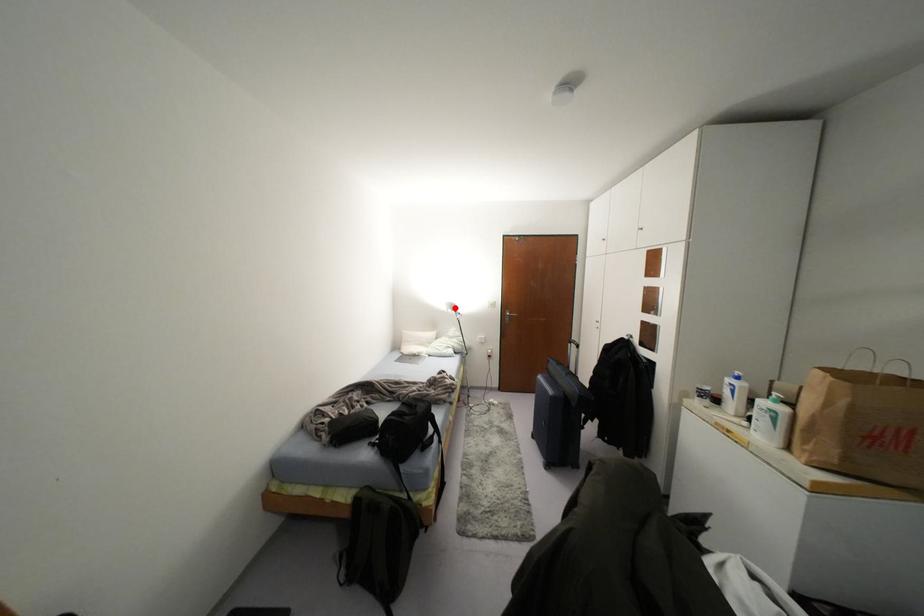
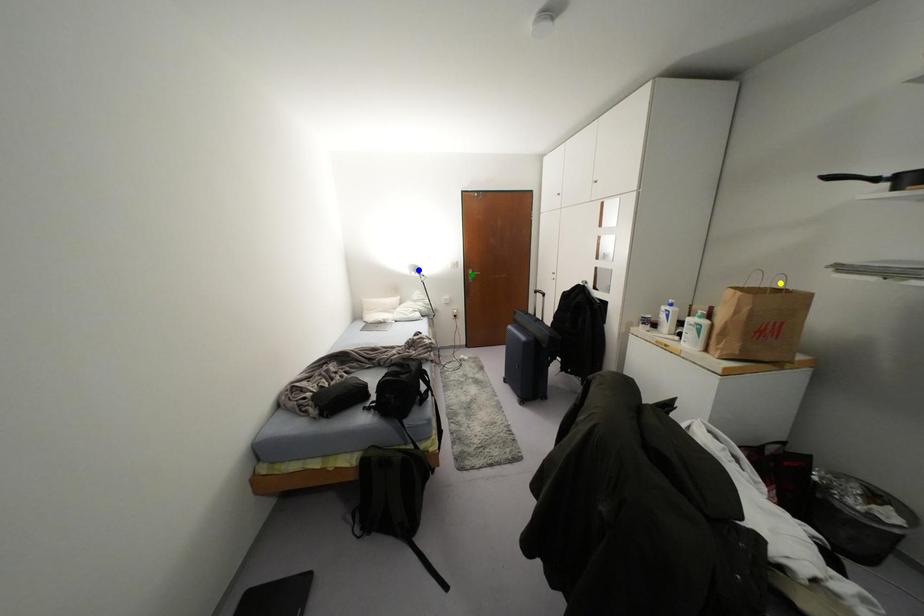
Question: I am providing you with two images of the same scene from different viewpoints. A red point is marked on the first image. You are given multiple points on the second image. In image 2, which mark is for the same physical point as the one in image 1?

Choices:
 (A) blue point
 (B) yellow point
 (C) green point

Answer: (A)